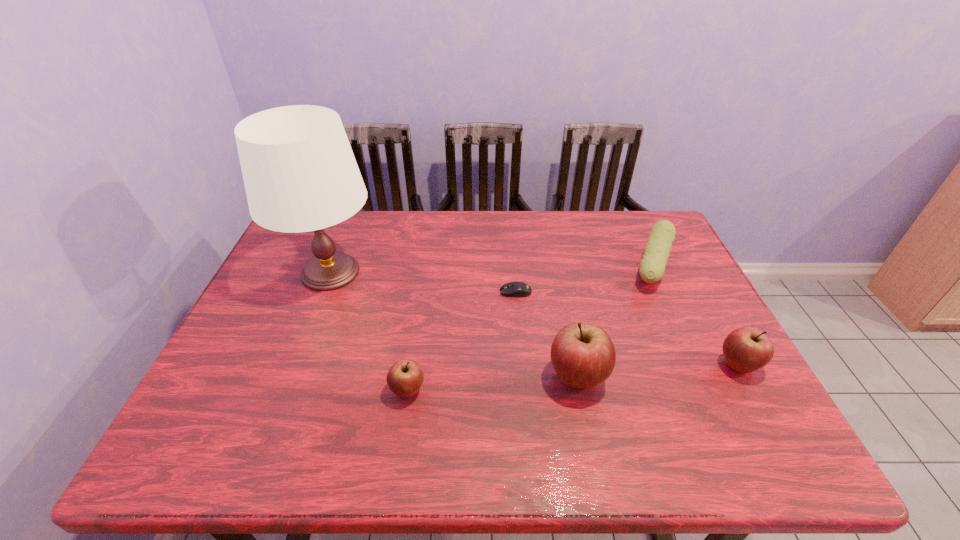
Image resolution: width=960 pixels, height=540 pixels. What are the coordinates of `free space between the third tallest object and the tallest object` in the screenshot? It's located at (535, 319).

Where is `empty space between the tallest object and the cucumber`? empty space between the tallest object and the cucumber is located at coordinates (492, 269).

This screenshot has width=960, height=540. In order to click on vacant area that lies between the tallest object and the cucumber in this screenshot , I will do `click(492, 269)`.

Locate an element on the screen. This screenshot has width=960, height=540. free space between the fifth object from right to left and the tallest object is located at coordinates (369, 332).

The image size is (960, 540). I want to click on unoccupied position between the computer mouse and the leftmost apple, so click(462, 341).

Locate an element on the screen. free space between the tallest apple and the fourth shortest object is located at coordinates (658, 372).

The width and height of the screenshot is (960, 540). What are the coordinates of `free space between the tallest apple and the rightmost apple` in the screenshot? It's located at (658, 372).

Identify the location of empty space between the second tallest object and the tallest object. coord(454,325).

Identify the location of vacant space in between the second shortest apple and the shortest object. Image resolution: width=960 pixels, height=540 pixels. (627, 329).

At what (x,y) coordinates should I click in order to perform the action: click on object that is the third closest to the leftmost apple. Please return your answer as a coordinate pair (x, y). Looking at the image, I should click on (513, 289).